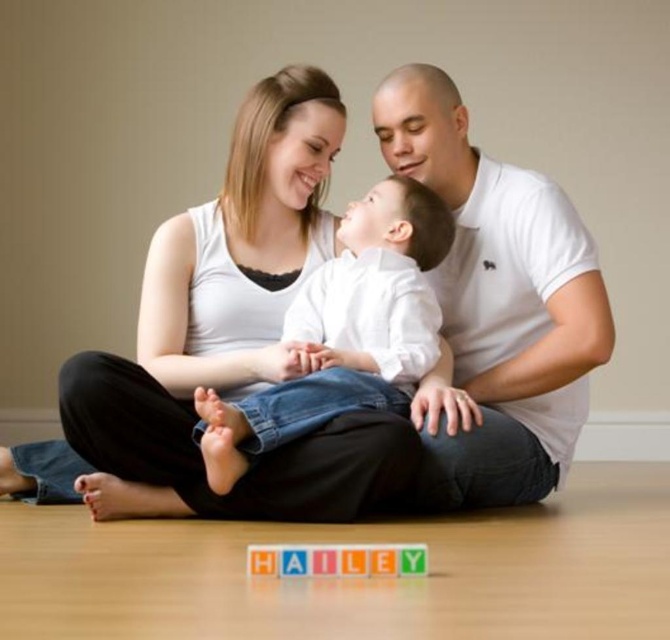
Is white cotton shirt at center thinner than multicolored plastic blocks at center?

Incorrect, white cotton shirt at center's width is not less than multicolored plastic blocks at center's.

Does white cotton shirt at center appear over multicolored plastic blocks at center?

Yes.

Measure the distance between white cotton shirt at center and camera.

They are 1.89 meters apart.

Locate an element on the screen. Image resolution: width=670 pixels, height=640 pixels. white cotton shirt at center is located at coordinates (496, 307).

Which is in front, point (496, 403) or point (212, 397)?

Point (212, 397) is more forward.

Is point (507, 346) positioned in front of point (409, 252)?

No, (507, 346) is behind (409, 252).

Does point (539, 298) lie behind point (371, 192)?

No, (539, 298) is closer to viewer.

Where is `white cotton shirt at center`? This screenshot has height=640, width=670. white cotton shirt at center is located at coordinates click(x=496, y=307).

Consider the image. Who is lower down, white smooth shirt at center or multicolored plastic blocks at center?

multicolored plastic blocks at center

Is white smooth shirt at center wider than multicolored plastic blocks at center?

Indeed, white smooth shirt at center has a greater width compared to multicolored plastic blocks at center.

Who is more distant from viewer, (338, 273) or (362, 548)?

Positioned behind is point (338, 273).

Where is `white smooth shirt at center`? This screenshot has width=670, height=640. white smooth shirt at center is located at coordinates (344, 330).